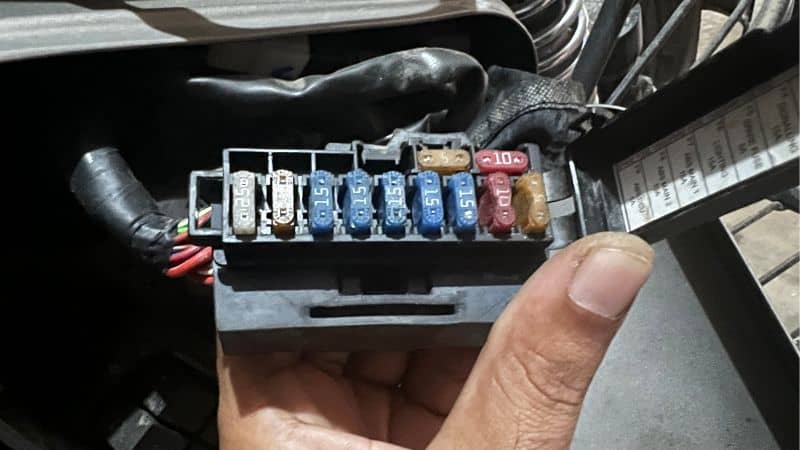
In order to click on floor in this screenshot , I will do `click(673, 392)`.